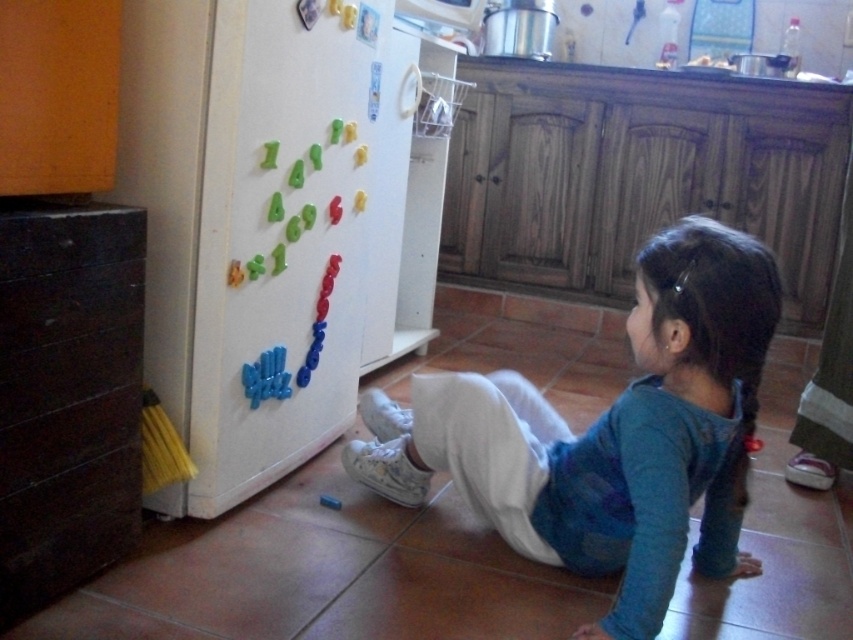
Is white matte refrigerator at left bigger than black wood drawer at left?

Yes, white matte refrigerator at left is bigger than black wood drawer at left.

Is the position of white matte refrigerator at left more distant than that of black wood drawer at left?

Yes.

Is point (369, 154) farther from camera compared to point (18, 442)?

Yes, it is.

Identify the location of white matte refrigerator at left. (250, 224).

Which is in front, point (169, 378) or point (630, 467)?

Point (630, 467) is in front.

Describe the element at coordinates (250, 224) in the screenshot. I see `white matte refrigerator at left` at that location.

This screenshot has width=853, height=640. What do you see at coordinates (250, 224) in the screenshot?
I see `white matte refrigerator at left` at bounding box center [250, 224].

Find the location of a particular element. Image resolution: width=853 pixels, height=640 pixels. white matte refrigerator at left is located at coordinates (250, 224).

How distant is blue cotton shirt at lower center from black wood drawer at left?

A distance of 27.45 inches exists between blue cotton shirt at lower center and black wood drawer at left.

Who is more forward, (364, 445) or (57, 512)?

Point (57, 512)

The height and width of the screenshot is (640, 853). What do you see at coordinates (608, 433) in the screenshot?
I see `blue cotton shirt at lower center` at bounding box center [608, 433].

The height and width of the screenshot is (640, 853). Identify the location of blue cotton shirt at lower center. (608, 433).